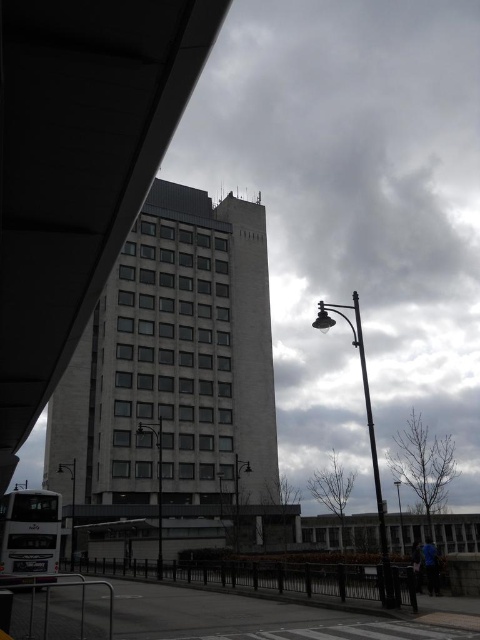
At what (x,y) coordinates should I click in order to perform the action: click on white concrete building at center. Please return your answer as a coordinate pair (x, y). Looking at the image, I should click on (173, 365).

This screenshot has width=480, height=640. I want to click on white concrete building at center, so click(173, 365).

Locate an element on the screen. white concrete building at center is located at coordinates point(173,365).

Does point (237, 536) come behind point (403, 554)?

Yes, point (237, 536) is behind point (403, 554).

Can you confirm if metallic gray pole at center is bigger than satin black pole at center?

No.

Is point (247, 468) farther from camera compared to point (402, 541)?

No.

The width and height of the screenshot is (480, 640). In order to click on metallic gray pole at center in this screenshot , I will do `click(238, 490)`.

Can you confirm if metallic streetlight at lower right is thinner than metallic gray streetlamp at lower left?

No.

Is metallic streetlight at lower right below metallic gray streetlamp at lower left?

Correct, metallic streetlight at lower right is located below metallic gray streetlamp at lower left.

The height and width of the screenshot is (640, 480). I want to click on metallic streetlight at lower right, so click(368, 428).